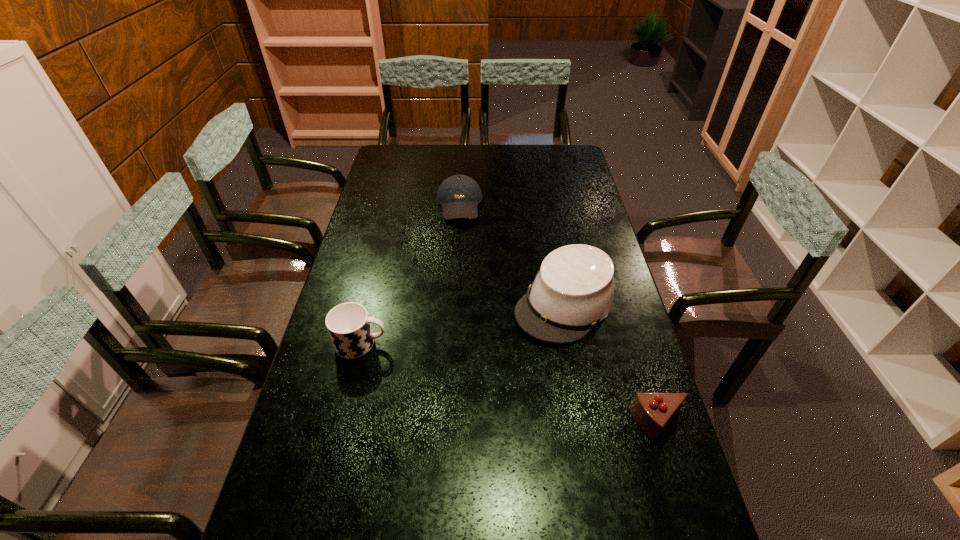
Identify the location of vacant region between the third object from right to left and the hat. The height and width of the screenshot is (540, 960). (512, 254).

This screenshot has height=540, width=960. Find the location of `free space between the hat and the cup`. free space between the hat and the cup is located at coordinates (463, 323).

The height and width of the screenshot is (540, 960). I want to click on free space that is in between the hat and the chocolate cake, so click(x=612, y=364).

Find the location of a particular element. The width and height of the screenshot is (960, 540). free space between the leftmost object and the hat is located at coordinates (463, 323).

Identify the location of vacant space that is in between the chocolate cake and the hat. Image resolution: width=960 pixels, height=540 pixels. (612, 364).

I want to click on vacant region between the farthest object and the hat, so click(x=512, y=254).

In order to click on free area in between the hat and the farthest object in this screenshot , I will do `click(512, 254)`.

This screenshot has width=960, height=540. In order to click on free area in between the hat and the chocolate cake in this screenshot , I will do `click(612, 364)`.

This screenshot has width=960, height=540. Find the location of `empty space that is in between the farthest object and the leftmost object`. empty space that is in between the farthest object and the leftmost object is located at coordinates (410, 274).

Point out which object is positioned as the third nearest to the cup. Please provide its 2D coordinates. Your answer should be formatted as a tuple, i.e. [(x, y)], where the tuple contains the x and y coordinates of a point satisfying the conditions above.

[(652, 412)]